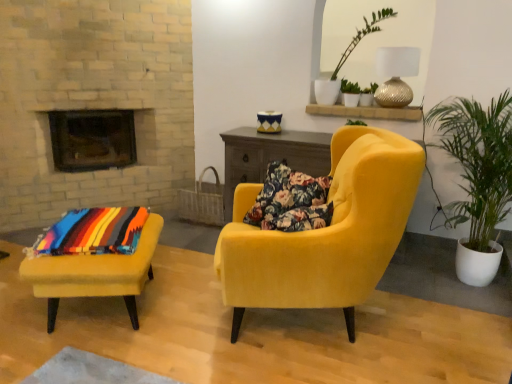
At what (x,y) coordinates should I click in order to perform the action: click on free space below velvet yellow armchair at center, which ranks as the 2th chair in left-to-right order (from a real-world perspective). Please return your answer as a coordinate pair (x, y). This screenshot has width=512, height=384. Looking at the image, I should click on (297, 330).